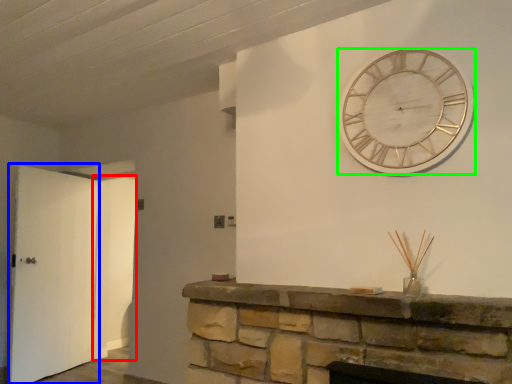
Question: Considering the real-world distances, which object is closest to door (highlighted by a red box)? door (highlighted by a blue box) or wall clock (highlighted by a green box).

Choices:
 (A) door
 (B) wall clock

Answer: (A)